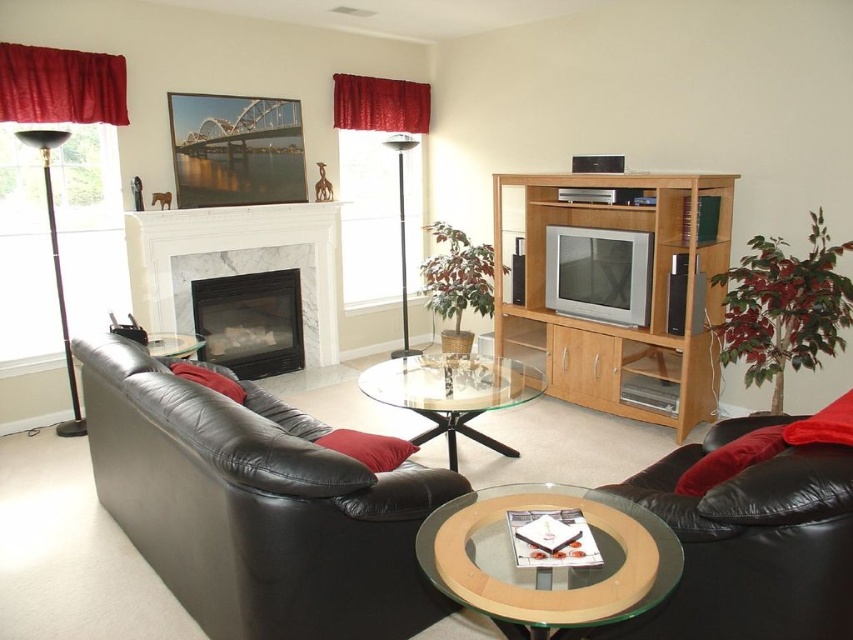
Question: Is black leather couch at lower left below transparent glass coffee table at center?

Choices:
 (A) yes
 (B) no

Answer: (A)

Question: Is black leather couch at lower right behind clear glass coffee table at center?

Choices:
 (A) no
 (B) yes

Answer: (B)

Question: Estimate the real-world distances between objects in this image. Which object is closer to the black leather couch at lower left?

Choices:
 (A) white marble fireplace at center
 (B) velvet red curtain at upper center
 (C) black leather couch at lower right
 (D) velvet red curtain at upper left

Answer: (C)

Question: Which of these objects is positioned closest to the velvet red curtain at upper center?

Choices:
 (A) transparent glass coffee table at center
 (B) white marble fireplace at center
 (C) black leather couch at lower right
 (D) velvet red curtain at upper left

Answer: (B)

Question: Can you confirm if white marble fireplace at center is positioned to the left of velvet red curtain at upper left?

Choices:
 (A) yes
 (B) no

Answer: (B)

Question: Which object is the closest to the white marble fireplace at center?

Choices:
 (A) velvet red curtain at upper center
 (B) black leather couch at lower left
 (C) velvet red curtain at upper left

Answer: (C)